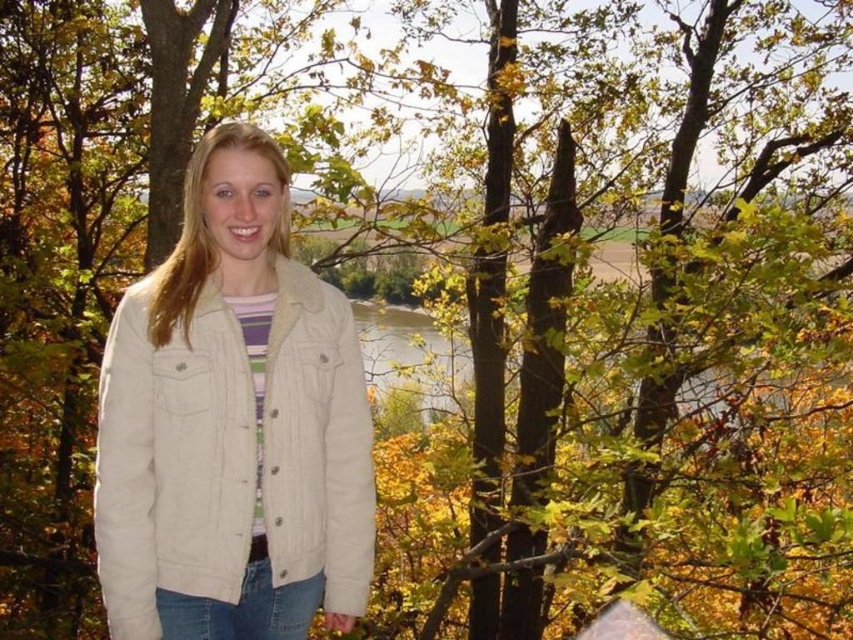
You are standing at the point labeled point (387, 371) and want to walk to the point labeled point (277, 433). According to the scene description, will you be moving towards the river or away from it?

Based on the coordinates provided, point (277, 433) is in front of point (387, 371). Since the river is part of the background in the scene, moving towards the point that is in front would mean moving away from the river. Therefore, you would be moving away from the river.

You are standing in an autumnal outdoor setting with a river and fields in the background. You see a beige corduroy jacket at center. If you want to pick up the jacket, how many steps do you estimate you need to take to reach it?

The beige corduroy jacket at center is 13.24 feet away from the viewer. Assuming an average step length of about 2.5 feet, you would need approximately 5 steps to reach it.